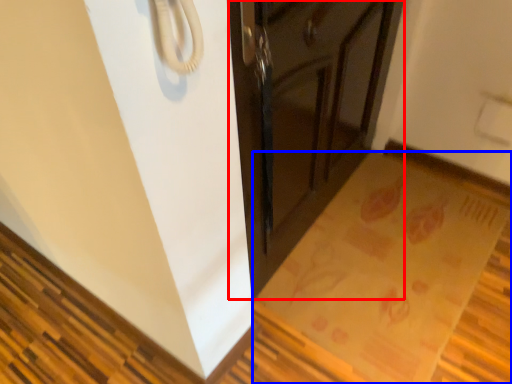
Question: Which point is further to the camera, cabinetry (highlighted by a red box) or mat (highlighted by a blue box)?

Choices:
 (A) cabinetry
 (B) mat

Answer: (B)